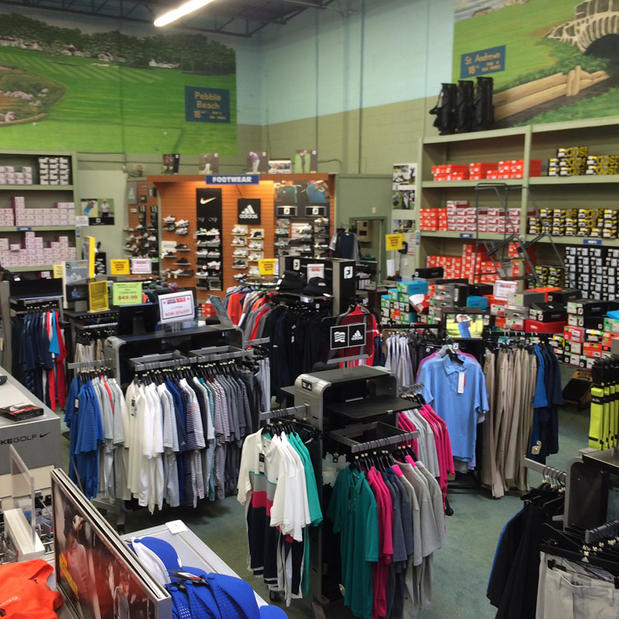
Image resolution: width=619 pixels, height=619 pixels. What are the coordinates of `floor` in the screenshot? It's located at (457, 553), (210, 543), (46, 448), (579, 439).